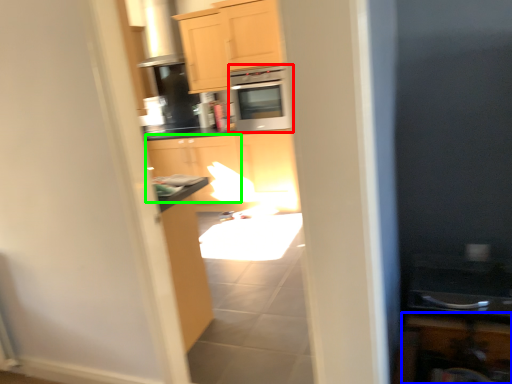
Question: Considering the real-world distances, which object is closest to microwave oven (highlighted by a red box)? cabinetry (highlighted by a blue box) or cabinetry (highlighted by a green box).

Choices:
 (A) cabinetry
 (B) cabinetry

Answer: (B)